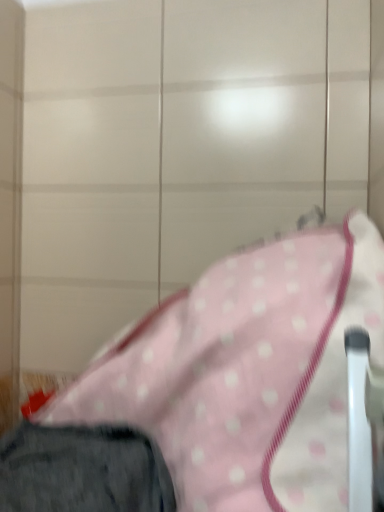
Question: Should I look upward or downward to see pink polka dot fabric at center?

Choices:
 (A) up
 (B) down

Answer: (B)

Question: Does pink polka dot fabric at center have a lesser height compared to dark gray fabric trousers at lower left?

Choices:
 (A) yes
 (B) no

Answer: (B)

Question: Is dark gray fabric trousers at lower left located within pink polka dot fabric at center?

Choices:
 (A) no
 (B) yes

Answer: (B)

Question: Is pink polka dot fabric at center not near dark gray fabric trousers at lower left?

Choices:
 (A) yes
 (B) no

Answer: (B)

Question: Are pink polka dot fabric at center and dark gray fabric trousers at lower left beside each other?

Choices:
 (A) yes
 (B) no

Answer: (B)

Question: Can you confirm if pink polka dot fabric at center is thinner than dark gray fabric trousers at lower left?

Choices:
 (A) yes
 (B) no

Answer: (B)

Question: From a real-world perspective, is pink polka dot fabric at center positioned over dark gray fabric trousers at lower left based on gravity?

Choices:
 (A) yes
 (B) no

Answer: (A)

Question: From a real-world perspective, is dark gray fabric trousers at lower left located higher than pink polka dot fabric at center?

Choices:
 (A) no
 (B) yes

Answer: (A)

Question: From the image's perspective, is dark gray fabric trousers at lower left located beneath pink polka dot fabric at center?

Choices:
 (A) no
 (B) yes

Answer: (B)

Question: Considering the relative positions of dark gray fabric trousers at lower left and pink polka dot fabric at center in the image provided, is dark gray fabric trousers at lower left to the right of pink polka dot fabric at center from the viewer's perspective?

Choices:
 (A) yes
 (B) no

Answer: (B)

Question: From the image's perspective, is dark gray fabric trousers at lower left above pink polka dot fabric at center?

Choices:
 (A) no
 (B) yes

Answer: (A)

Question: Considering the relative sizes of dark gray fabric trousers at lower left and pink polka dot fabric at center in the image provided, is dark gray fabric trousers at lower left wider than pink polka dot fabric at center?

Choices:
 (A) no
 (B) yes

Answer: (A)

Question: Considering the relative sizes of dark gray fabric trousers at lower left and pink polka dot fabric at center in the image provided, is dark gray fabric trousers at lower left bigger than pink polka dot fabric at center?

Choices:
 (A) yes
 (B) no

Answer: (B)

Question: Would you say dark gray fabric trousers at lower left is to the left or to the right of pink polka dot fabric at center in the picture?

Choices:
 (A) left
 (B) right

Answer: (A)